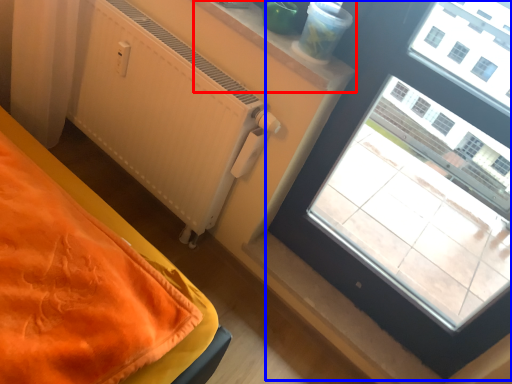
Question: Which of the following is the farthest to the observer, window sill (highlighted by a red box) or window (highlighted by a blue box)?

Choices:
 (A) window sill
 (B) window

Answer: (A)